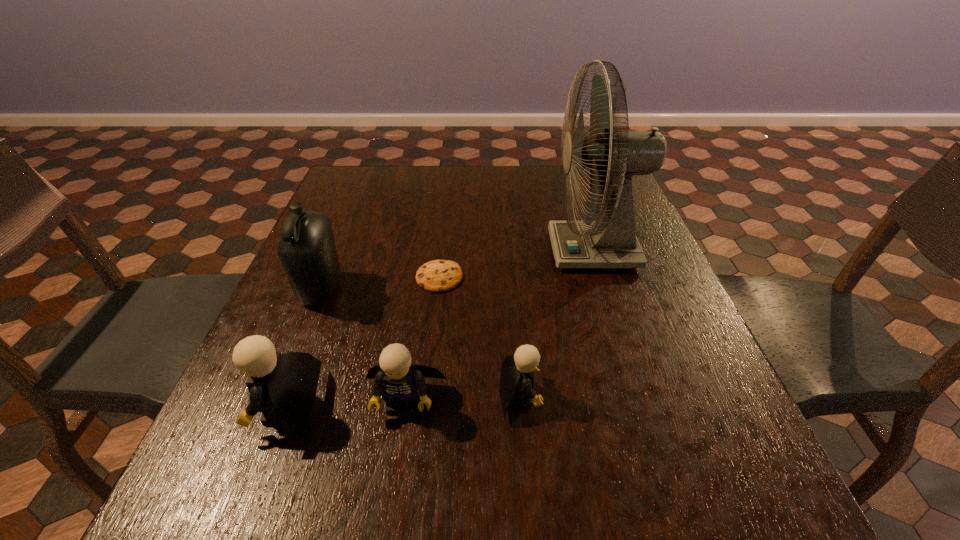
Locate an element on the screen. vacant space at the near edge of the desktop is located at coordinates (500, 407).

In the image, there is a desktop. Where is `free space at the left edge`? The image size is (960, 540). free space at the left edge is located at coordinates (290, 330).

This screenshot has height=540, width=960. I want to click on free spot at the right edge of the desktop, so click(660, 267).

In the image, there is a desktop. Identify the location of free space at the far left corner. This screenshot has height=540, width=960. (336, 193).

Identify the location of free spot between the shortest object and the third shortest object. This screenshot has width=960, height=540. (422, 339).

Where is `free area in between the second shortest Lego and the fifth shortest object`? free area in between the second shortest Lego and the fifth shortest object is located at coordinates (363, 345).

Identify the location of vacant space that is in between the fifth shortest object and the second object from right to left. (420, 342).

This screenshot has height=540, width=960. Identify the location of free spot between the shortest Lego and the second tallest Lego. (462, 398).

Find the location of a particular element. free space between the leftmost Lego and the second Lego from left to right is located at coordinates (346, 404).

You are a GUI agent. You are given a task and a screenshot of the screen. Output one action in this format:
    pyautogui.click(x=<x>, y=<y>)
    Task: Click on the empty space between the rightmost Lego and the third shortest object
    
    Given the screenshot: What is the action you would take?
    pyautogui.click(x=462, y=398)